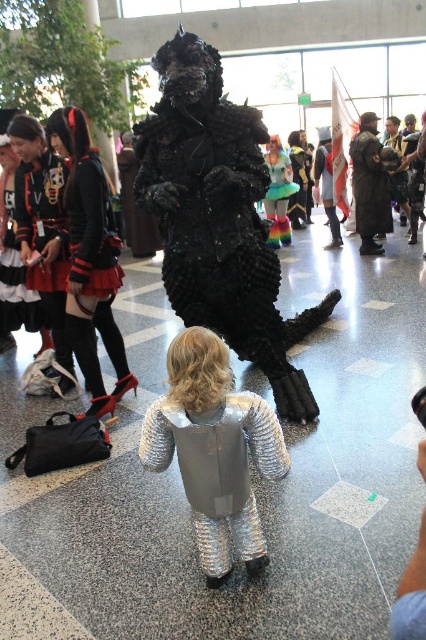
You are an event organizer at the convention. You need to arrange a photo shoot where the velvet black dress at left and the shiny silver armor at center will be featured. Considering their sizes, which one should be placed in the foreground to make them both visible in the photo?

The velvet black dress at left is taller than the shiny silver armor at center, so placing the shorter shiny silver armor at center in the foreground would allow both to be visible in the photo.

You are a photographer at the event and want to capture a photo that includes both the velvet black dress at left and the shiny teal figurine at center. Based on their positions, which object should you ensure is in the lower part of the frame?

The velvet black dress at left should be placed in the lower part of the frame since it is located below the shiny teal figurine at center.